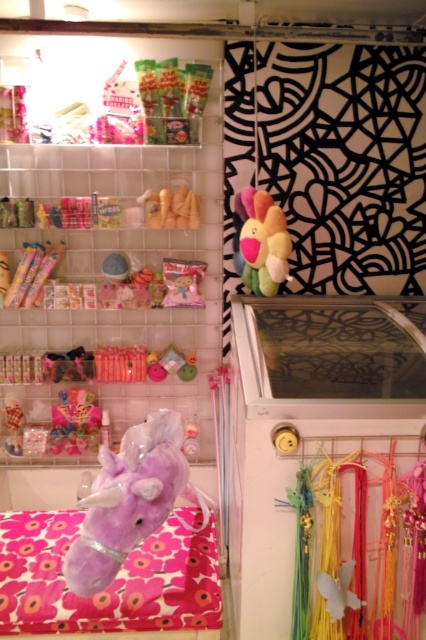
Question: Which point appears closest to the camera in this image?

Choices:
 (A) (129, 522)
 (B) (278, 260)
 (C) (207, 198)

Answer: (A)

Question: Is pink matte candy at upper left closer to the viewer compared to purple plush unicorn at center?

Choices:
 (A) no
 (B) yes

Answer: (A)

Question: Estimate the real-world distances between objects in this image. Which object is farther from the pink matte candy at upper left?

Choices:
 (A) soft plush toy at center
 (B) purple plush unicorn at center

Answer: (B)

Question: Can you confirm if pink matte candy at upper left is thinner than purple plush unicorn at center?

Choices:
 (A) yes
 (B) no

Answer: (B)

Question: Estimate the real-world distances between objects in this image. Which object is closer to the soft plush toy at center?

Choices:
 (A) pink matte candy at upper left
 (B) purple plush unicorn at center

Answer: (A)

Question: Does pink matte candy at upper left lie in front of purple plush unicorn at center?

Choices:
 (A) yes
 (B) no

Answer: (B)